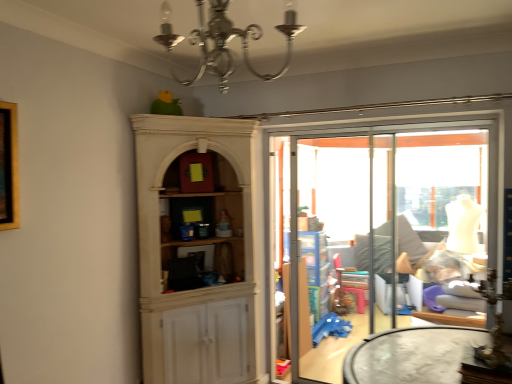
This screenshot has height=384, width=512. In order to click on vacant point above transparent glass screen door at center (from a real-world perspective) in this screenshot , I will do `click(343, 135)`.